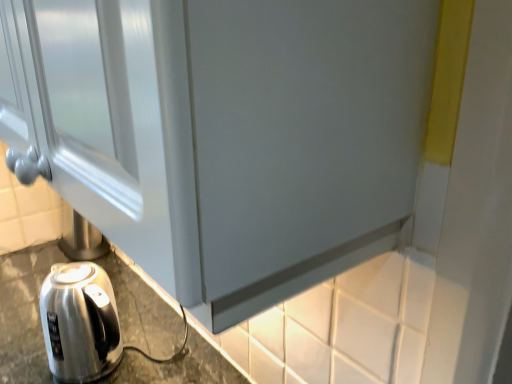
Where is `satin metallic kettle at lower left`? satin metallic kettle at lower left is located at coordinates (24, 313).

Image resolution: width=512 pixels, height=384 pixels. Describe the element at coordinates (24, 313) in the screenshot. I see `satin metallic kettle at lower left` at that location.

Where is `satin metallic kettle at lower left`? satin metallic kettle at lower left is located at coordinates (24, 313).